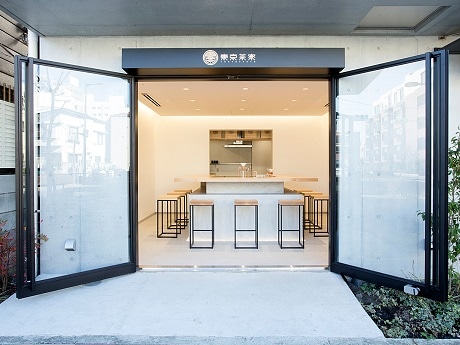
Find the location of a particular element. This screenshot has width=460, height=345. lights is located at coordinates (x=183, y=88), (x=191, y=101), (x=196, y=110), (x=240, y=108), (x=243, y=99), (x=243, y=88), (x=286, y=108), (x=294, y=99), (x=303, y=88).